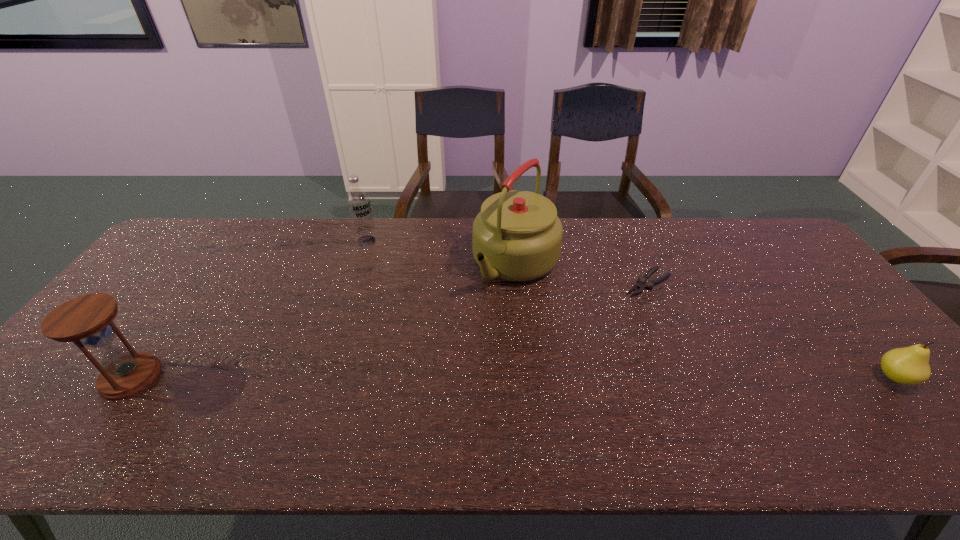
The height and width of the screenshot is (540, 960). In the image, there is a desktop. Find the location of `free space at the near left corner`. free space at the near left corner is located at coordinates (73, 395).

In order to click on vacant point located between the second object from left to right and the hourglass in this screenshot , I will do `click(249, 309)`.

You are a GUI agent. You are given a task and a screenshot of the screen. Output one action in this format:
    pyautogui.click(x=<x>, y=<y>)
    Task: Click on the vacant space that is in between the vodka and the hourglass
    The width and height of the screenshot is (960, 540).
    Given the screenshot: What is the action you would take?
    pyautogui.click(x=249, y=309)

This screenshot has width=960, height=540. What are the coordinates of `free space between the vodka and the pear` in the screenshot? It's located at (631, 309).

You are a GUI agent. You are given a task and a screenshot of the screen. Output one action in this format:
    pyautogui.click(x=<x>, y=<y>)
    Task: Click on the vacant point located between the pliers and the fourth tallest object
    
    Given the screenshot: What is the action you would take?
    pyautogui.click(x=771, y=330)

This screenshot has width=960, height=540. I want to click on empty space that is in between the second shortest object and the shortest object, so click(x=771, y=330).

Locate an element on the screen. The height and width of the screenshot is (540, 960). free space between the vodka and the tallest object is located at coordinates (442, 252).

Where is `vacant space in between the kettle and the pliers`? vacant space in between the kettle and the pliers is located at coordinates (582, 273).

You are a GUI agent. You are given a task and a screenshot of the screen. Output one action in this format:
    pyautogui.click(x=<x>, y=<y>)
    Task: Click on the free spot between the third object from left to right and the leftmost object
    The width and height of the screenshot is (960, 540).
    Given the screenshot: What is the action you would take?
    pyautogui.click(x=324, y=320)

Find the location of a particular element. vacant area between the hourglass and the pear is located at coordinates (513, 377).